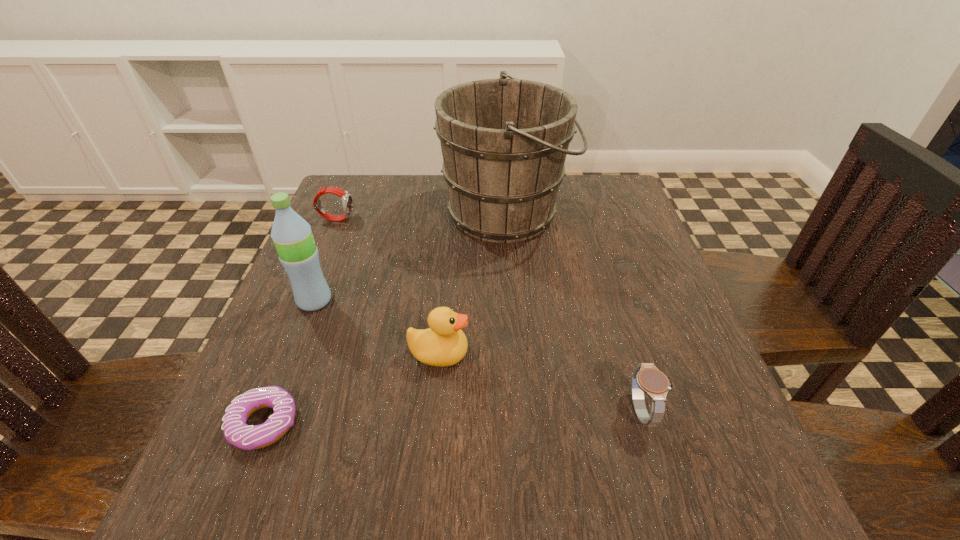
The width and height of the screenshot is (960, 540). I want to click on object that is the closest to the duck, so [236, 431].

At what (x,y) coordinates should I click in order to perform the action: click on object that ranks as the fourth closest to the tallest object. Please return your answer as a coordinate pair (x, y). Looking at the image, I should click on (647, 378).

Where is `vacant space that satisfies the following two spatial constraints: 1. on the handle side of the tallest object; 2. on the right side of the nearer watch`? vacant space that satisfies the following two spatial constraints: 1. on the handle side of the tallest object; 2. on the right side of the nearer watch is located at coordinates [522, 411].

At what (x,y) coordinates should I click in order to perform the action: click on free point that satisfies the following two spatial constraints: 1. on the face of the farther watch; 2. on the left side of the shortest object. Please return your answer as a coordinate pair (x, y). Image resolution: width=960 pixels, height=540 pixels. Looking at the image, I should click on (251, 423).

Identify the location of free space that satisfies the following two spatial constraints: 1. on the handle side of the right watch; 2. on the left side of the bucket. The height and width of the screenshot is (540, 960). (522, 411).

Where is `free location that satisfies the following two spatial constraints: 1. on the face of the left watch; 2. on the right side of the water bottle`? free location that satisfies the following two spatial constraints: 1. on the face of the left watch; 2. on the right side of the water bottle is located at coordinates (301, 301).

Identify the location of free space that satisfies the following two spatial constraints: 1. on the face of the farther watch; 2. on the back side of the shortest object. Image resolution: width=960 pixels, height=540 pixels. (251, 423).

Identify the location of blank area in the image that satisfies the following two spatial constraints: 1. at the beak of the fourth farthest object; 2. on the back side of the nearer watch. (434, 411).

This screenshot has height=540, width=960. Identify the location of vacant space that satisfies the following two spatial constraints: 1. at the beak of the duck; 2. on the right side of the right watch. (434, 411).

Where is `free point that satisfies the following two spatial constraints: 1. on the face of the right watch; 2. on the right side of the left watch`? The height and width of the screenshot is (540, 960). free point that satisfies the following two spatial constraints: 1. on the face of the right watch; 2. on the right side of the left watch is located at coordinates (255, 411).